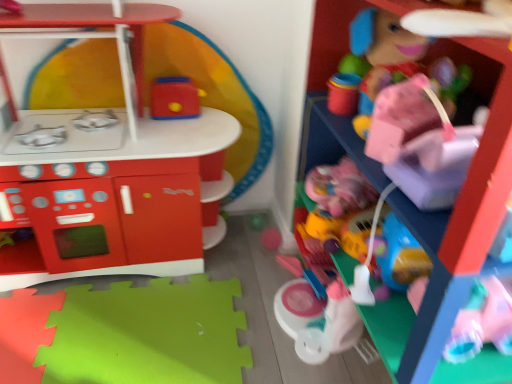
Locate an element on the screen. This screenshot has width=512, height=384. vacant area that is in front of matte plastic play kitchen at left, which ranks as the 1th toy in left-to-right order is located at coordinates (98, 328).